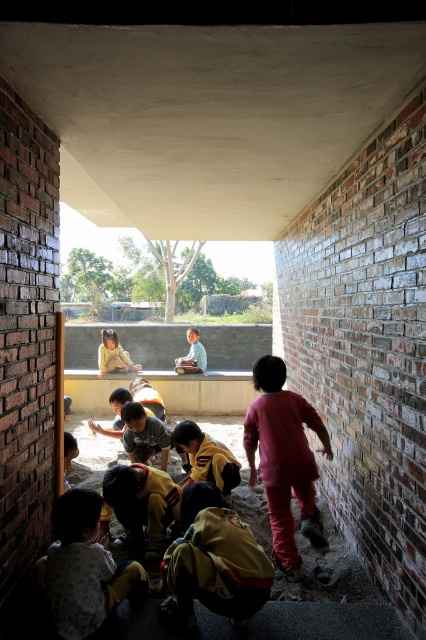
Question: Among these points, which one is nearest to the camera?

Choices:
 (A) (49, 582)
 (B) (115, 339)
 (C) (190, 340)
 (D) (155, 508)

Answer: (A)

Question: Which object is the farthest from the light brown fabric baby at lower left?

Choices:
 (A) yellow fabric pants at lower center
 (B) light blue shirt at center
 (C) matte yellow shirt at center
 (D) yellow fabric at center

Answer: (B)

Question: Is light brown fabric baby at lower left positioned in front of matte yellow shirt at center?

Choices:
 (A) yes
 (B) no

Answer: (A)

Question: Can you confirm if light brown fabric baby at lower left is smaller than yellow fabric pants at lower center?

Choices:
 (A) no
 (B) yes

Answer: (B)

Question: Can you confirm if pink matte pants at lower right is positioned to the right of light brown fabric baby at lower left?

Choices:
 (A) no
 (B) yes

Answer: (B)

Question: Among these objects, which one is nearest to the camera?

Choices:
 (A) yellow fabric at center
 (B) light blue shirt at center
 (C) pink matte pants at lower right

Answer: (C)